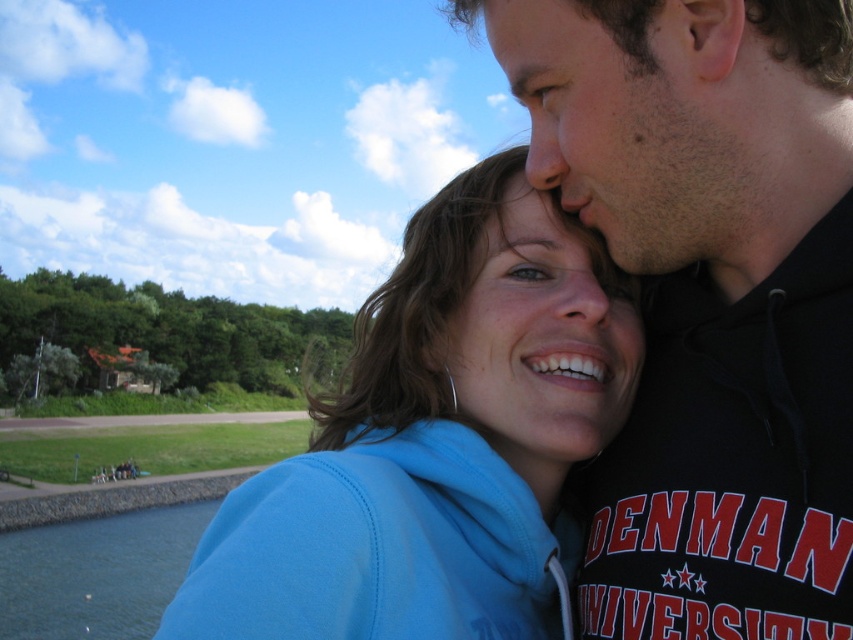
Question: Which point is farther to the camera?

Choices:
 (A) (68, 608)
 (B) (578, 310)
 (C) (601, 184)

Answer: (A)

Question: Estimate the real-world distances between objects in this image. Which object is farther from the black matte hoodie at upper right?

Choices:
 (A) clear water at lower left
 (B) blue fleece jacket at center

Answer: (A)

Question: Does blue fleece jacket at center have a lesser width compared to clear water at lower left?

Choices:
 (A) no
 (B) yes

Answer: (B)

Question: Can you confirm if blue fleece jacket at center is smaller than clear water at lower left?

Choices:
 (A) no
 (B) yes

Answer: (B)

Question: Which object appears farthest from the camera in this image?

Choices:
 (A) blue fleece jacket at center
 (B) black matte hoodie at upper right
 (C) clear water at lower left

Answer: (C)

Question: Is the position of black matte hoodie at upper right less distant than that of blue fleece jacket at center?

Choices:
 (A) yes
 (B) no

Answer: (B)